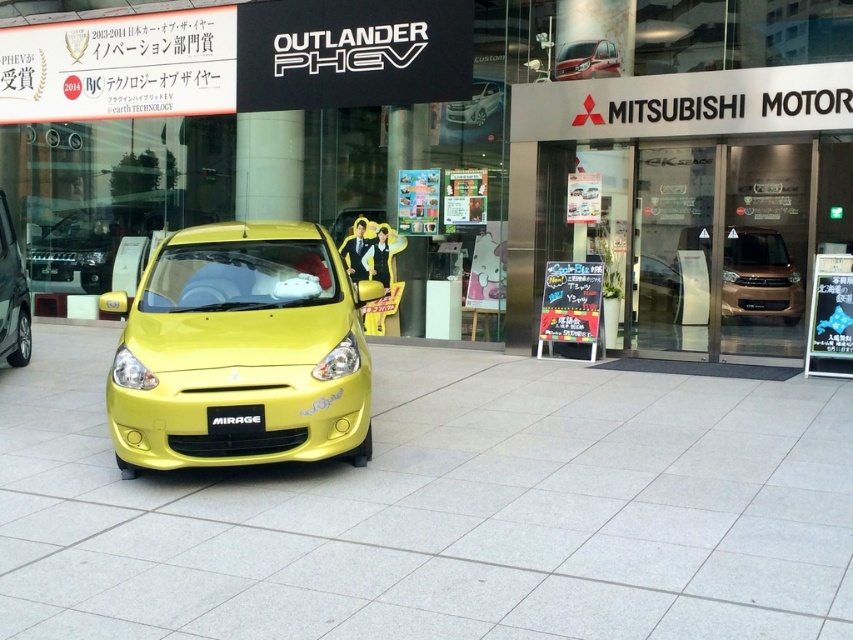
You are a customer at the Mitsubishi dealership and want to see the license plate of the car displayed at the center. Can you see the yellow matte license plate at center from your current position in front of the metallic yellow car at center?

The yellow matte license plate at center is behind the metallic yellow car at center, so you cannot see it from your current position in front of the metallic yellow car at center.

You are standing in front of the Mitsubishi dealership and see the gold metallic suv at center and the yellow matte hatchback at center. Which vehicle is positioned to the right of the other?

The gold metallic suv at center is to the right of the yellow matte hatchback at center.